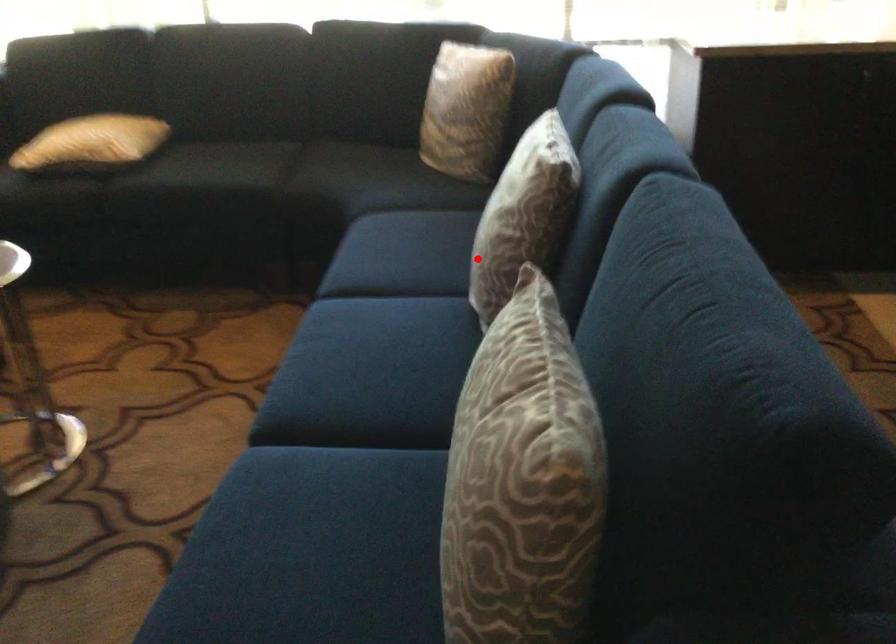
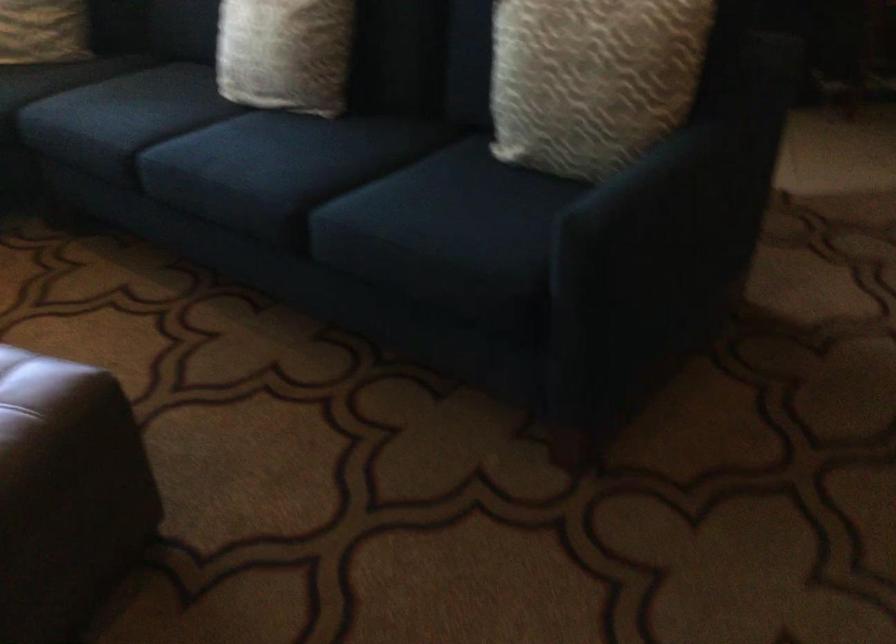
The point at the highlighted location is marked in the first image. Where is the corresponding point in the second image?

(285, 53)